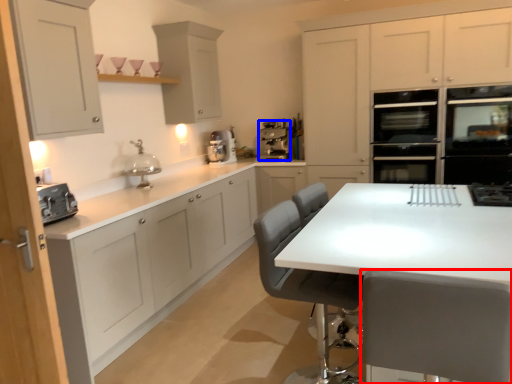
Question: Which of the following is the closest to the observer, chair (highlighted by a red box) or appliance (highlighted by a blue box)?

Choices:
 (A) chair
 (B) appliance

Answer: (A)